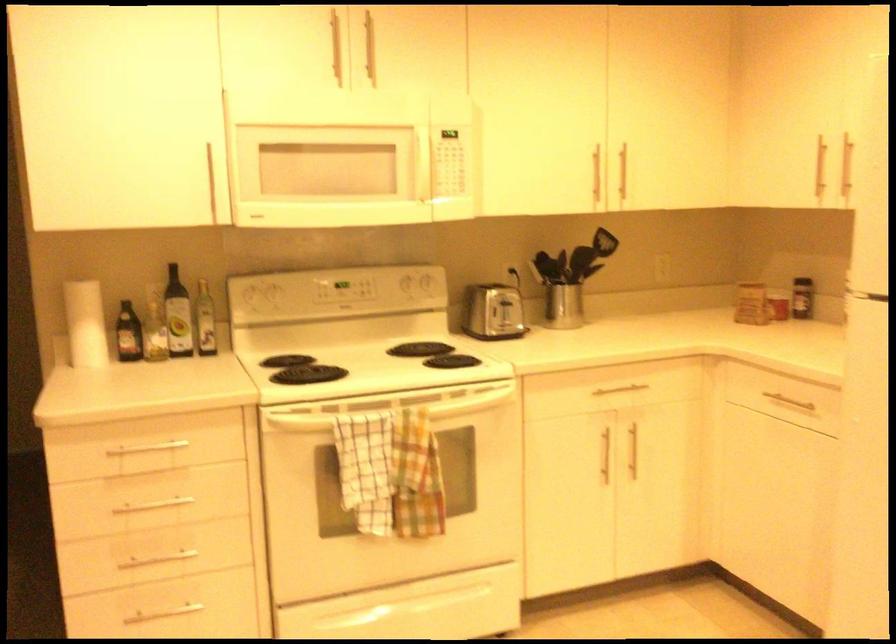
The location [127,333] corresponds to which object?

It refers to a dark glass bottle.